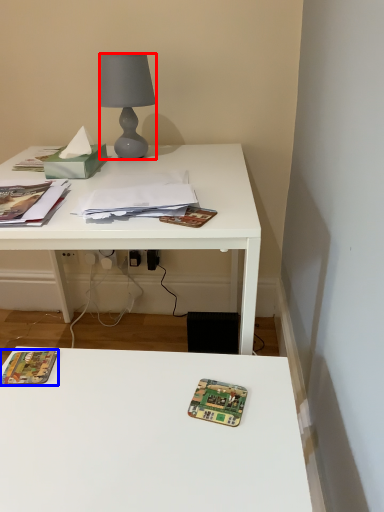
Question: Which of the following is the closest to the observer, lamp (highlighted by a red box) or paperback book (highlighted by a blue box)?

Choices:
 (A) lamp
 (B) paperback book

Answer: (B)